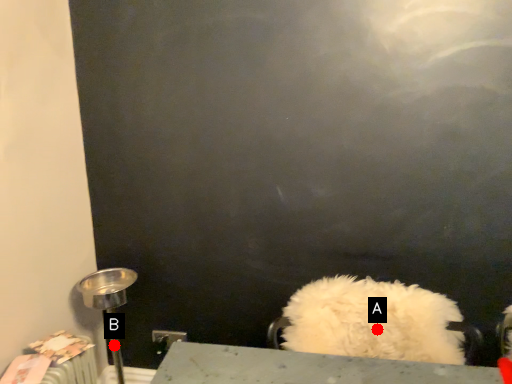
Question: Two points are circled on the image, labeled by A and B beside each circle. Which of the following is the closest to the observer?

Choices:
 (A) A is closer
 (B) B is closer

Answer: (A)